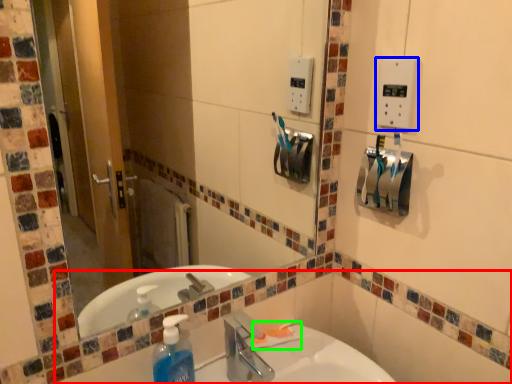
Question: Which is farther away from bath (highlighted by a red box)? light switch (highlighted by a blue box) or toothpaste (highlighted by a green box)?

Choices:
 (A) light switch
 (B) toothpaste

Answer: (A)